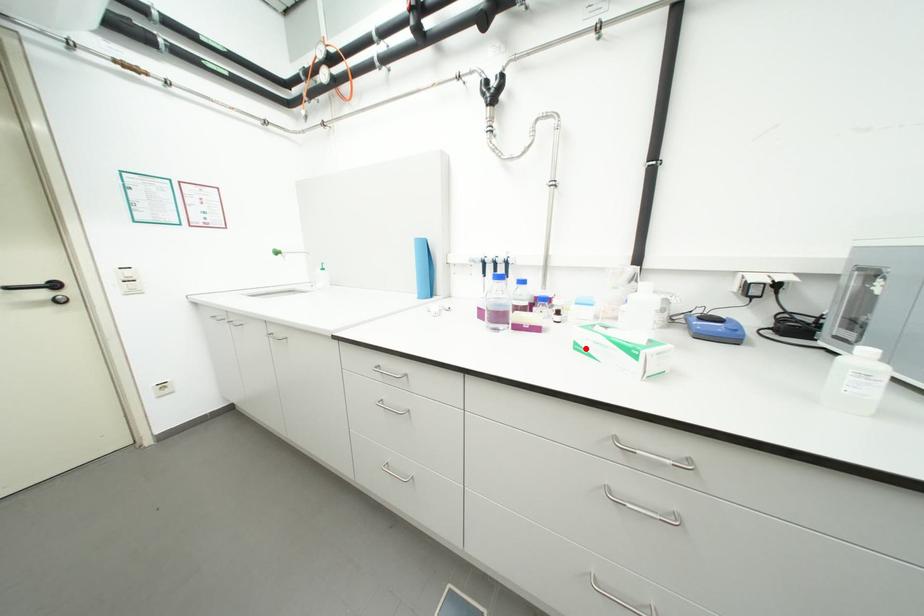
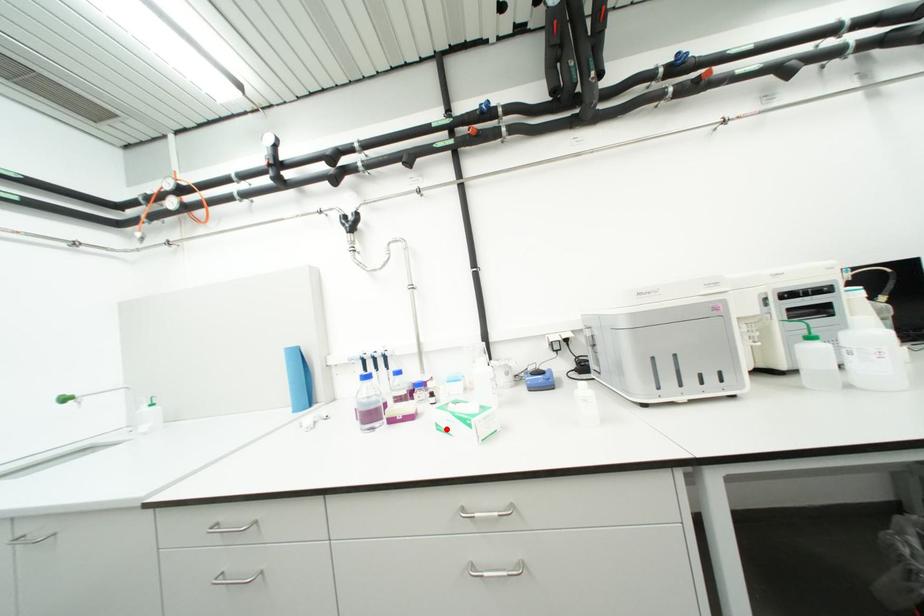
I am providing you with two images of the same scene from different viewpoints. A red point is marked on the first image and another point is marked on the second image. Do the highlighted points in image1 and image2 indicate the same real-world spot?

Yes